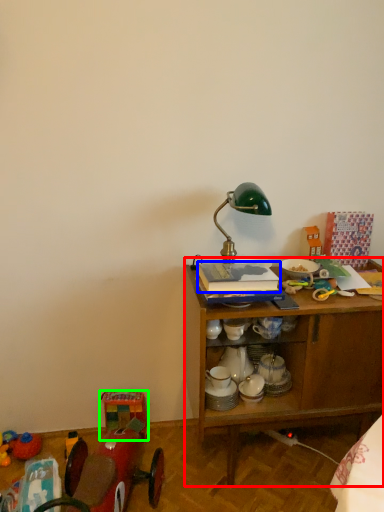
Question: Which object is positioned closest to desk (highlighted by a red box)? Select from book (highlighted by a blue box) and toy (highlighted by a green box).

Choices:
 (A) book
 (B) toy

Answer: (A)